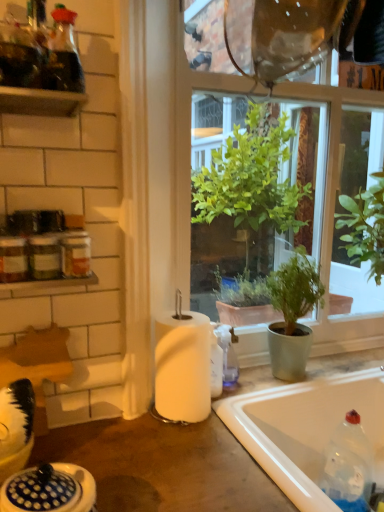
Where is `free location in front of white matte paper towel at center`? The height and width of the screenshot is (512, 384). free location in front of white matte paper towel at center is located at coordinates (184, 459).